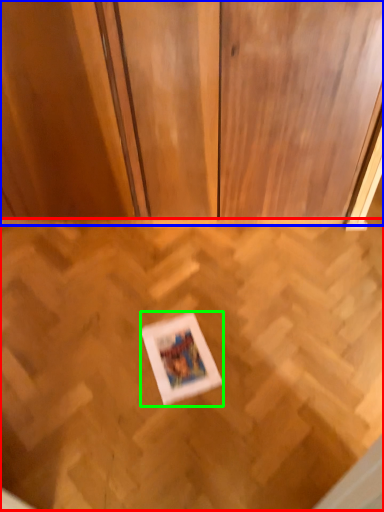
Question: Which object is positioned closest to plywood (highlighted by a red box)? Select from dresser (highlighted by a blue box) and picture frame (highlighted by a green box).

Choices:
 (A) dresser
 (B) picture frame

Answer: (B)